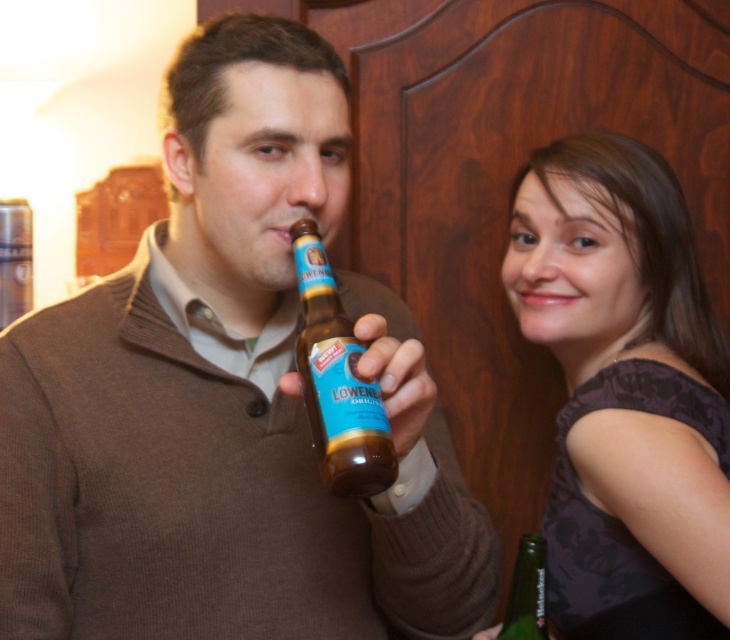
Question: Which object is closer to the camera taking this photo?

Choices:
 (A) brown sweater at center
 (B) green glass bottle at lower right
 (C) brown glass bottle at center

Answer: (C)

Question: Can you confirm if brown glass bottle at center is positioned to the left of green glass bottle at lower right?

Choices:
 (A) yes
 (B) no

Answer: (A)

Question: Is brown sweater at center bigger than green glass bottle at lower right?

Choices:
 (A) no
 (B) yes

Answer: (B)

Question: Which of these objects is positioned closest to the brown sweater at center?

Choices:
 (A) matte black dress at right
 (B) green glass bottle at lower right
 (C) brown glass bottle at center

Answer: (C)

Question: Which of the following is the farthest from the observer?

Choices:
 (A) green glass bottle at lower right
 (B) matte black dress at right

Answer: (B)

Question: Can you confirm if brown sweater at center is positioned to the left of green glass bottle at lower right?

Choices:
 (A) yes
 (B) no

Answer: (A)